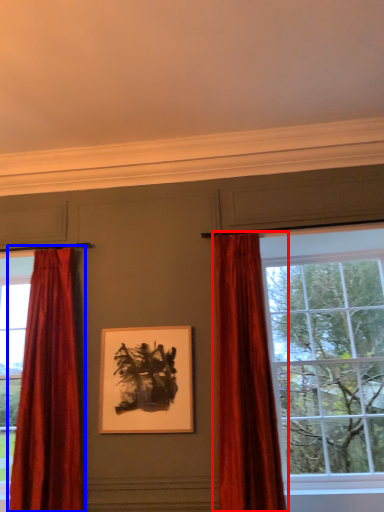
Question: Which of the following is the closest to the observer, curtain (highlighted by a red box) or curtain (highlighted by a blue box)?

Choices:
 (A) curtain
 (B) curtain

Answer: (A)